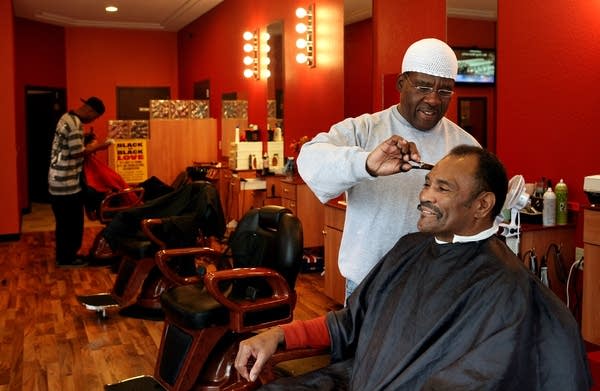
I want to click on chair, so click(x=277, y=246).